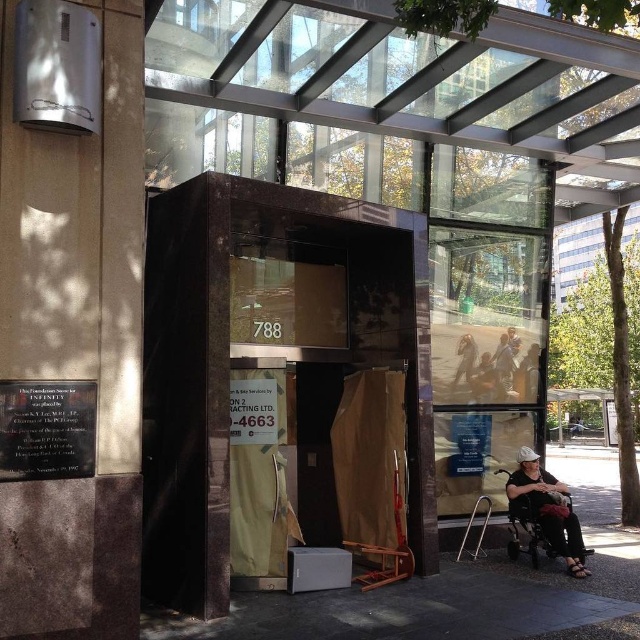
Is black fabric wheelchair at lower right wider than dark blue jeans at center?

Indeed, black fabric wheelchair at lower right has a greater width compared to dark blue jeans at center.

Does black fabric wheelchair at lower right appear over dark blue jeans at center?

Actually, black fabric wheelchair at lower right is below dark blue jeans at center.

Describe the element at coordinates (547, 508) in the screenshot. I see `black fabric wheelchair at lower right` at that location.

Image resolution: width=640 pixels, height=640 pixels. In order to click on black fabric wheelchair at lower right in this screenshot , I will do `click(547, 508)`.